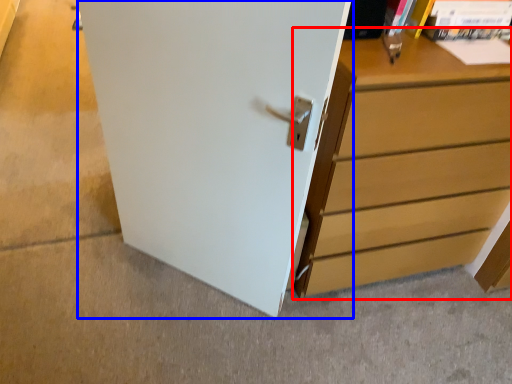
Question: Which point is further to the camera, chest of drawers (highlighted by a red box) or door (highlighted by a blue box)?

Choices:
 (A) chest of drawers
 (B) door

Answer: (A)